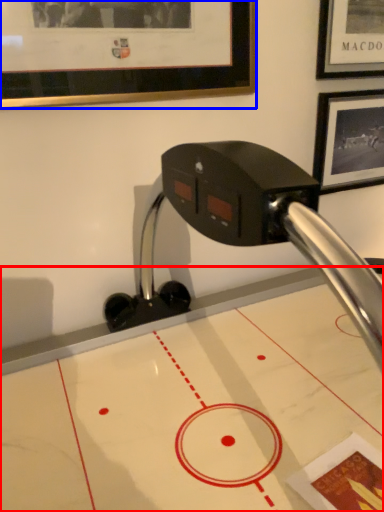
Question: Which of the following is the closest to the observer, table (highlighted by a red box) or picture frame (highlighted by a blue box)?

Choices:
 (A) table
 (B) picture frame

Answer: (A)